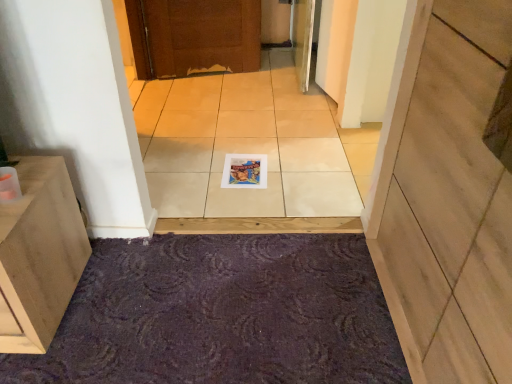
The width and height of the screenshot is (512, 384). I want to click on purple textured bath mat at lower center, so click(222, 314).

This screenshot has width=512, height=384. What do you see at coordinates (243, 145) in the screenshot?
I see `white glossy tile at center` at bounding box center [243, 145].

The image size is (512, 384). I want to click on wooden at center, so click(448, 198).

Which point is more distant from viewer, (226,182) or (236,112)?

The point (236,112) is more distant.

Locate an element on the screen. The image size is (512, 384). magazine below the white glossy tile at center (from a real-world perspective) is located at coordinates coord(245,171).

Between matte paper magazine at center and white glossy tile at center, which one has more height?

With more height is matte paper magazine at center.

Between matte paper magazine at center and white glossy tile at center, which one has smaller width?

With smaller width is matte paper magazine at center.

This screenshot has height=384, width=512. Find the location of `ceramic tile above the wooden at center (from the image's perspective)`. ceramic tile above the wooden at center (from the image's perspective) is located at coordinates (243, 145).

Is wooden at center in contact with white glossy tile at center?

No, wooden at center is not in contact with white glossy tile at center.

Consider the image. From a real-world perspective, between wooden at center and white glossy tile at center, who is vertically higher?

In real-world perspective, wooden at center is above.

Considering the positions of point (436, 349) and point (290, 90), is point (436, 349) closer or farther from the camera than point (290, 90)?

Point (436, 349) is closer to the camera than point (290, 90).

Would you consider wooden at center to be distant from purple textured bath mat at lower center?

No.

Who is taller, wooden at center or purple textured bath mat at lower center?

Standing taller between the two is wooden at center.

Which point is more forward, (417, 330) or (254, 303)?

The point (417, 330) is closer to the camera.

Considering the relative positions of wooden at center and purple textured bath mat at lower center in the image provided, is wooden at center in front of purple textured bath mat at lower center?

Yes, wooden at center is closer to the viewer.

Considering the relative positions of purple textured bath mat at lower center and wooden at center in the image provided, is purple textured bath mat at lower center to the left of wooden at center from the viewer's perspective?

Yes, purple textured bath mat at lower center is to the left of wooden at center.

Find the location of `door positioned vertically above the purple textured bath mat at lower center (from a real-world perspective)`. door positioned vertically above the purple textured bath mat at lower center (from a real-world perspective) is located at coordinates (448, 198).

Considering the positions of point (95, 285) and point (492, 350), is point (95, 285) closer or farther from the camera than point (492, 350)?

Point (95, 285) is farther from the camera than point (492, 350).

In the scene shown: Is purple textured bath mat at lower center not close to wooden at center?

purple textured bath mat at lower center is near wooden at center, not far away.

Can we say purple textured bath mat at lower center lies outside matte paper magazine at center?

Yes, purple textured bath mat at lower center is outside of matte paper magazine at center.

Between purple textured bath mat at lower center and matte paper magazine at center, which one has less height?

With less height is matte paper magazine at center.

Considering the sizes of objects purple textured bath mat at lower center and matte paper magazine at center in the image provided, who is smaller, purple textured bath mat at lower center or matte paper magazine at center?

matte paper magazine at center.

Is purple textured bath mat at lower center further to the viewer compared to matte paper magazine at center?

No, purple textured bath mat at lower center is closer to the camera.

Does wooden at center have a smaller size compared to matte paper magazine at center?

No.

Is the depth of wooden at center less than that of matte paper magazine at center?

That is True.

Is wooden at center with matte paper magazine at center?

wooden at center and matte paper magazine at center are not in contact.

Does purple textured bath mat at lower center come in front of white glossy tile at center?

Yes, the depth of purple textured bath mat at lower center is less than that of white glossy tile at center.

Looking at this image, between purple textured bath mat at lower center and white glossy tile at center, which one has less height?

Standing shorter between the two is white glossy tile at center.

Is purple textured bath mat at lower center oriented away from white glossy tile at center?

That's not correct — purple textured bath mat at lower center is not looking away from white glossy tile at center.

The image size is (512, 384). I want to click on magazine below the white glossy tile at center (from the image's perspective), so click(x=245, y=171).

At what (x,y) coordinates should I click in order to perform the action: click on ceramic tile located above the wooden at center (from the image's perspective). Please return your answer as a coordinate pair (x, y). This screenshot has width=512, height=384. Looking at the image, I should click on (243, 145).

From the image, which object appears to be nearer to matte paper magazine at center, white glossy tile at center or purple textured bath mat at lower center?

The object closer to matte paper magazine at center is white glossy tile at center.

Considering their positions, is matte paper magazine at center positioned further to wooden at center than white glossy tile at center?

matte paper magazine at center lies further to wooden at center than the other object.

From the image, which object appears to be nearer to purple textured bath mat at lower center, white glossy tile at center or matte paper magazine at center?

white glossy tile at center is positioned closer to the anchor purple textured bath mat at lower center.

Which object lies nearer to the anchor point white glossy tile at center, matte paper magazine at center or wooden at center?

matte paper magazine at center lies closer to white glossy tile at center than the other object.

Which object lies nearer to the anchor point white glossy tile at center, wooden at center or matte paper magazine at center?

Based on the image, matte paper magazine at center appears to be nearer to white glossy tile at center.

When comparing their distances from matte paper magazine at center, does purple textured bath mat at lower center or wooden at center seem further?

The object further to matte paper magazine at center is wooden at center.

From the image, which object appears to be farther from white glossy tile at center, matte paper magazine at center or purple textured bath mat at lower center?

Based on the image, purple textured bath mat at lower center appears to be further to white glossy tile at center.

When comparing their distances from purple textured bath mat at lower center, does matte paper magazine at center or wooden at center seem further?

matte paper magazine at center.

Where is `ceramic tile between wooden at center and matte paper magazine at center from front to back`? The height and width of the screenshot is (384, 512). ceramic tile between wooden at center and matte paper magazine at center from front to back is located at coordinates (243, 145).

This screenshot has width=512, height=384. What are the coordinates of `bath mat between wooden at center and matte paper magazine at center along the z-axis` in the screenshot? It's located at (222, 314).

Identify the location of bath mat between wooden at center and white glossy tile at center along the z-axis. point(222,314).

Identify the location of magazine between white glossy tile at center and purple textured bath mat at lower center vertically. (245, 171).